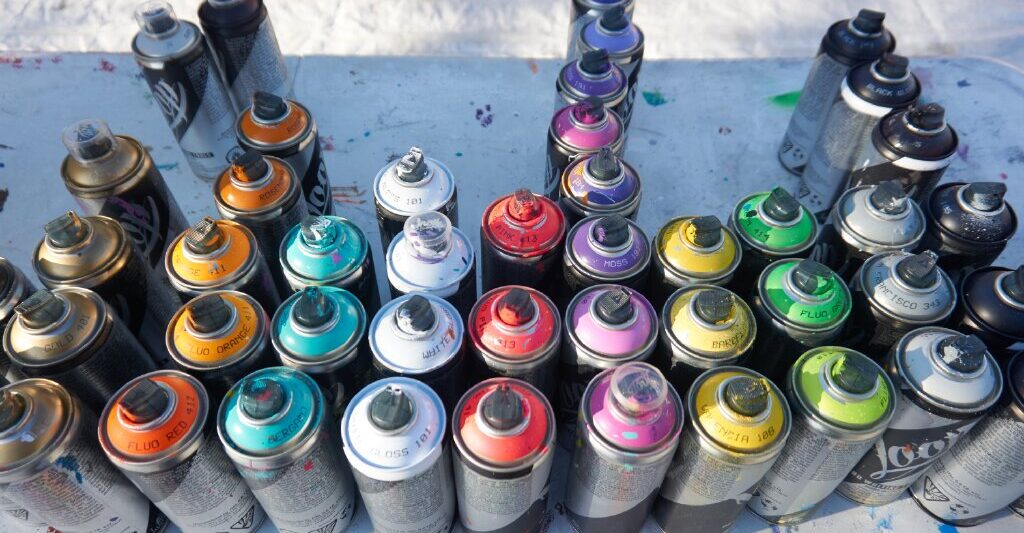
Where is `paint`? paint is located at coordinates (479, 125).